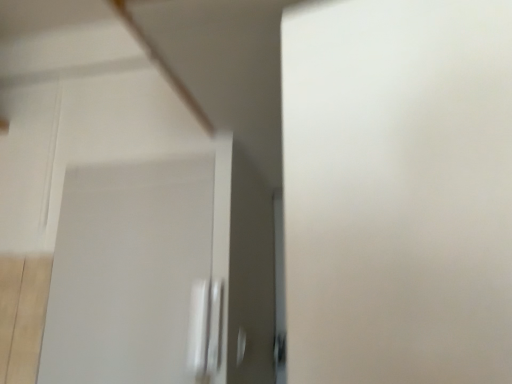
I want to click on white plastic door handle at center, so click(x=207, y=330).

The width and height of the screenshot is (512, 384). What do you see at coordinates (207, 330) in the screenshot? I see `white plastic door handle at center` at bounding box center [207, 330].

Find the location of a particular element. white plastic door handle at center is located at coordinates (207, 330).